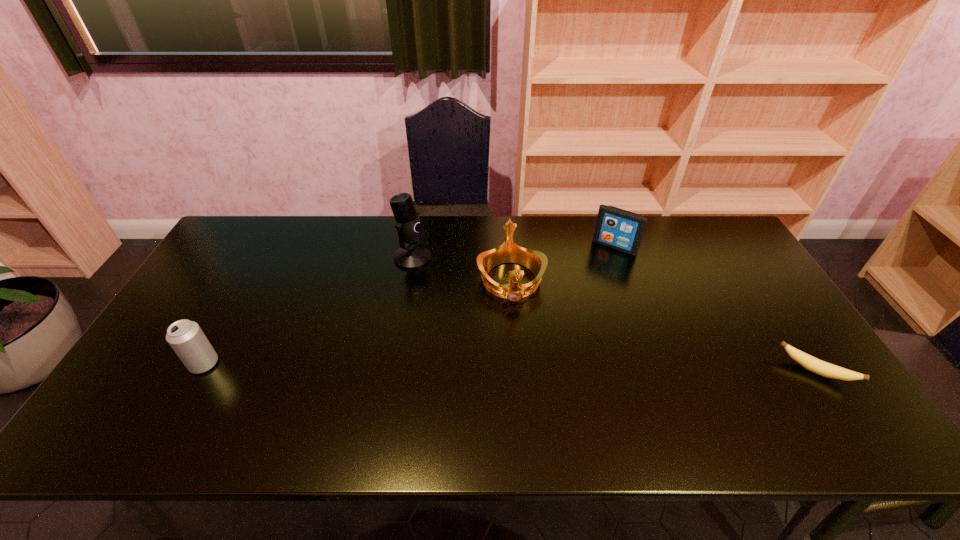
I want to click on iPod located at the far edge, so click(x=616, y=228).

Identify the location of object that is positioned at the near edge. (815, 365).

This screenshot has height=540, width=960. I want to click on object that is at the left edge, so point(186,338).

This screenshot has width=960, height=540. Identify the location of object at the right edge. (815, 365).

The image size is (960, 540). I want to click on object that is positioned at the near right corner, so click(x=815, y=365).

Identify the location of blank space at the far edge of the desktop. (557, 241).

You are a GUI agent. You are given a task and a screenshot of the screen. Output one action in this format:
    pyautogui.click(x=<x>, y=<y>)
    Task: Click on the vacant space at the near edge of the desktop
    Image resolution: width=960 pixels, height=540 pixels.
    Given the screenshot: What is the action you would take?
    pyautogui.click(x=285, y=402)

Where is `vacant space at the left edge of the desktop`? vacant space at the left edge of the desktop is located at coordinates (192, 295).

At what (x,y) coordinates should I click in order to perform the action: click on vacant region at the far left corner. Please return your answer as a coordinate pair (x, y). This screenshot has height=540, width=960. Looking at the image, I should click on (268, 220).

Image resolution: width=960 pixels, height=540 pixels. In order to click on free space at the far right corner of the desktop in this screenshot , I will do `click(710, 222)`.